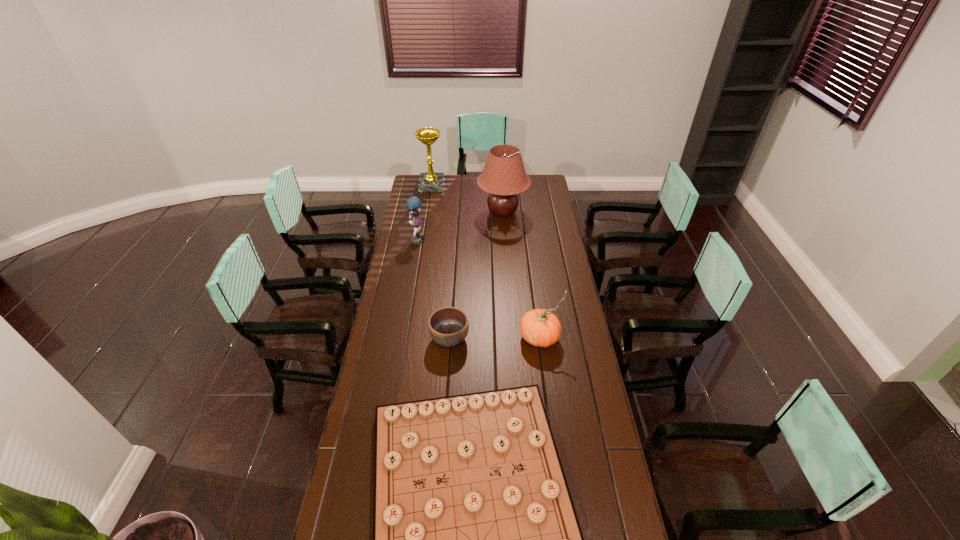
Find the location of `free space in the image that satisfies the following two spatial constraints: 1. on the front-facing side of the third farthest object; 2. on the left side of the pumpkin`. free space in the image that satisfies the following two spatial constraints: 1. on the front-facing side of the third farthest object; 2. on the left side of the pumpkin is located at coordinates (400, 337).

Where is `vacant region that satisfies the following two spatial constraints: 1. on the back side of the pumpkin; 2. on the front-facing side of the third farthest object`? vacant region that satisfies the following two spatial constraints: 1. on the back side of the pumpkin; 2. on the front-facing side of the third farthest object is located at coordinates (527, 238).

The image size is (960, 540). I want to click on vacant area that satisfies the following two spatial constraints: 1. on the front-facing side of the fifth nearest object; 2. on the front-facing side of the rag doll, so click(504, 238).

Identify the location of free point that satisfies the following two spatial constraints: 1. on the back side of the pumpkin; 2. on the front-facing side of the award. (520, 185).

I want to click on free region that satisfies the following two spatial constraints: 1. on the front-facing side of the rag doll; 2. on the left side of the bowl, so click(x=400, y=339).